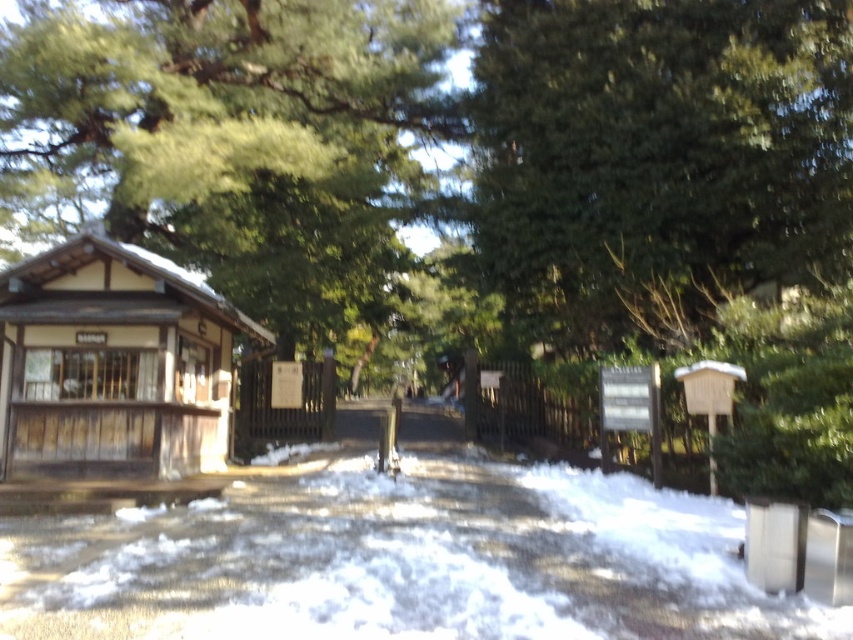
Question: Among these points, which one is farthest from the camera?

Choices:
 (A) (320, 628)
 (B) (61, 301)

Answer: (B)

Question: Where is white fluffy snow at center located in relation to brown wooden hut at left in the image?

Choices:
 (A) right
 (B) left

Answer: (A)

Question: From the image, what is the correct spatial relationship of white fluffy snow at center in relation to brown wooden hut at left?

Choices:
 (A) above
 (B) below

Answer: (B)

Question: Which point is closer to the camera?

Choices:
 (A) brown wooden hut at left
 (B) white fluffy snow at center

Answer: (B)

Question: Can you confirm if white fluffy snow at center is positioned below brown wooden hut at left?

Choices:
 (A) yes
 (B) no

Answer: (A)